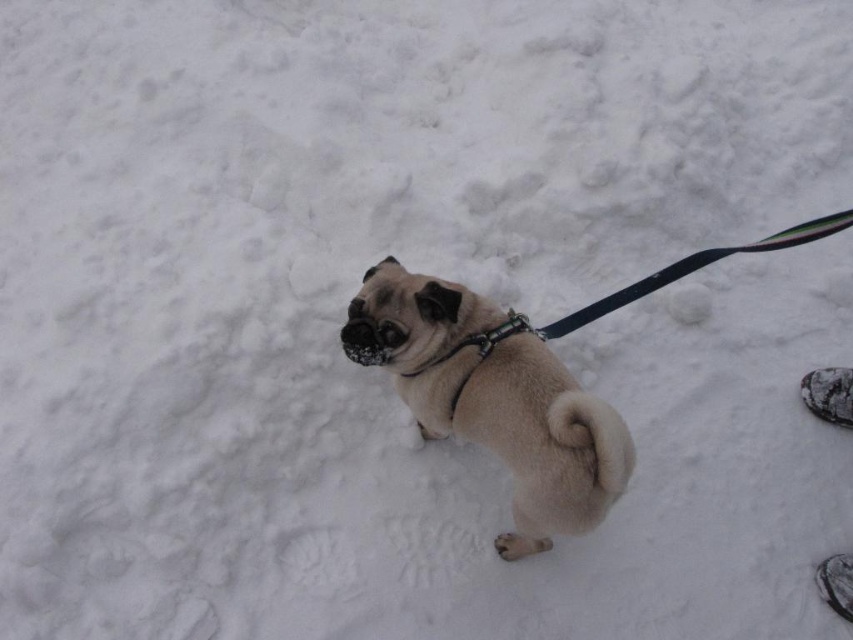
Between fuzzy beige dog at center and metallic chain at center, which one is positioned higher?

Positioned higher is metallic chain at center.

Who is taller, fuzzy beige dog at center or metallic chain at center?

With more height is fuzzy beige dog at center.

Is point (397, 305) closer to viewer compared to point (454, 412)?

Yes.

Locate an element on the screen. fuzzy beige dog at center is located at coordinates [494, 397].